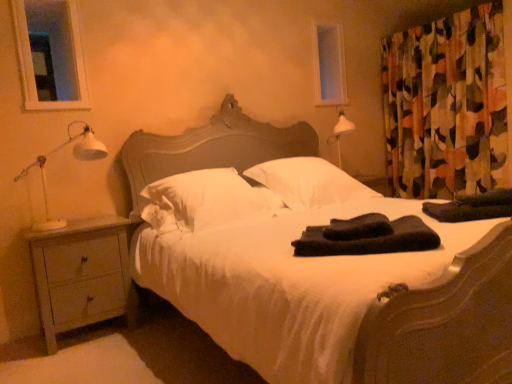
What are the coordinates of `white satin bed at center` in the screenshot? It's located at click(x=340, y=299).

Image resolution: width=512 pixels, height=384 pixels. What do you see at coordinates (204, 200) in the screenshot? I see `white soft pillow at center, positioned as the first pillow in left-to-right order` at bounding box center [204, 200].

At what (x,y) coordinates should I click in order to perform the action: click on transparent glass window screen at upper center, which is the 2th window screen in front-to-back order. Please return your answer as a coordinate pair (x, y). The width and height of the screenshot is (512, 384). Looking at the image, I should click on (x=329, y=64).

This screenshot has width=512, height=384. Identify the location of transparent glass window at upper left, placed as the first window screen when sorted from front to back. (51, 52).

What do you see at coordinates (51, 52) in the screenshot? I see `transparent glass window at upper left, placed as the first window screen when sorted from front to back` at bounding box center [51, 52].

At what (x,y) coordinates should I click in order to perform the action: click on white matte table lamp at left. Please return your answer as a coordinate pair (x, y). Looking at the image, I should click on (74, 157).

Can you see black soft towels at center, the 1th material positioned from the front, touching black towel at right, which is counted as the 1th material, starting from the right?

There is a gap between black soft towels at center, the 1th material positioned from the front, and black towel at right, which is counted as the 1th material, starting from the right.

Locate an element on the screen. This screenshot has width=512, height=384. material that appears behind the black soft towels at center, the 2th material viewed from the right is located at coordinates (472, 207).

Between black soft towels at center, the 1th material positioned from the front, and black towel at right, which is counted as the 1th material, starting from the right, which one appears on the left side from the viewer's perspective?

Positioned to the left is black soft towels at center, the 1th material positioned from the front.

Does point (298, 253) lie in front of point (471, 211)?

Yes, it is.

In terms of width, does black soft towel at center look wider or thinner when compared to white soft pillow at center, which is the 2th pillow in right-to-left order?

black soft towel at center is thinner than white soft pillow at center, which is the 2th pillow in right-to-left order.

Is black soft towel at center not near white soft pillow at center, which is the 2th pillow in right-to-left order?

No, black soft towel at center is not far away from white soft pillow at center, which is the 2th pillow in right-to-left order.

Is black soft towel at center positioned with its back to white soft pillow at center, positioned as the first pillow in left-to-right order?

No, black soft towel at center's orientation is not away from white soft pillow at center, positioned as the first pillow in left-to-right order.

What's the angular difference between black soft towel at center and white soft pillow at center, positioned as the first pillow in left-to-right order,'s facing directions?

There is a 45.9-degree angle between the facing directions of black soft towel at center and white soft pillow at center, positioned as the first pillow in left-to-right order.

Is black soft towels at center, the 1th material positioned from the front, to the left or to the right of transparent glass window screen at upper center, acting as the first window screen starting from the back, in the image?

black soft towels at center, the 1th material positioned from the front, is to the left of transparent glass window screen at upper center, acting as the first window screen starting from the back.

In the scene shown: Does black soft towels at center, the 2th material viewed from the right, have a lesser height compared to transparent glass window screen at upper center, which is the second window screen from left to right?

Yes, black soft towels at center, the 2th material viewed from the right, is shorter than transparent glass window screen at upper center, which is the second window screen from left to right.

Is black soft towels at center, arranged as the second material when viewed from the back, located outside transparent glass window screen at upper center, which is the 2th window screen in front-to-back order?

Yes, black soft towels at center, arranged as the second material when viewed from the back, is located beyond the bounds of transparent glass window screen at upper center, which is the 2th window screen in front-to-back order.

From the image's perspective, which is above, white soft pillow at center, which is the 2th pillow in right-to-left order, or black towel at right, which is the second material in left-to-right order?

white soft pillow at center, which is the 2th pillow in right-to-left order, appears higher in the image.

Between white soft pillow at center, which is the 2th pillow in right-to-left order, and black towel at right, which is the second material in left-to-right order, which one has more height?

white soft pillow at center, which is the 2th pillow in right-to-left order.

Does point (208, 209) lie in front of point (445, 219)?

Yes, point (208, 209) is closer to viewer.

Considering the relative positions of white soft pillow at center, which is the 2th pillow in right-to-left order, and black towel at right, which is counted as the 1th material, starting from the right, in the image provided, is white soft pillow at center, which is the 2th pillow in right-to-left order, behind black towel at right, which is counted as the 1th material, starting from the right,?

Yes, it is.

Considering the sizes of objects white soft pillow at center, which appears as the 1th pillow when viewed from the right, and white satin bed at center in the image provided, who is thinner, white soft pillow at center, which appears as the 1th pillow when viewed from the right, or white satin bed at center?

white soft pillow at center, which appears as the 1th pillow when viewed from the right, is thinner.

Considering the points (278, 168) and (252, 365), which point is behind, point (278, 168) or point (252, 365)?

Positioned behind is point (278, 168).

Are white soft pillow at center, which appears as the 1th pillow when viewed from the right, and white satin bed at center beside each other?

white soft pillow at center, which appears as the 1th pillow when viewed from the right, is not next to white satin bed at center, and they're not touching.

Is black towel at right, the first material when ordered from back to front, facing towards light gray wood nightstand at lower left?

No, black towel at right, the first material when ordered from back to front, is not oriented towards light gray wood nightstand at lower left.

Which object is positioned more to the left, black towel at right, which is counted as the 1th material, starting from the right, or light gray wood nightstand at lower left?

light gray wood nightstand at lower left is more to the left.

From a real-world perspective, is black towel at right, the first material when ordered from back to front, positioned above or below light gray wood nightstand at lower left?

From a real-world perspective, black towel at right, the first material when ordered from back to front, is physically above light gray wood nightstand at lower left.

Does black towel at right, which is the second material in left-to-right order, have a lesser height compared to light gray wood nightstand at lower left?

Indeed, black towel at right, which is the second material in left-to-right order, has a lesser height compared to light gray wood nightstand at lower left.

Considering the relative sizes of white satin bed at center and white soft pillow at center, positioned as the first pillow in left-to-right order, in the image provided, is white satin bed at center bigger than white soft pillow at center, positioned as the first pillow in left-to-right order,?

Yes, white satin bed at center is bigger than white soft pillow at center, positioned as the first pillow in left-to-right order.

Which of these two, white satin bed at center or white soft pillow at center, which is the 2th pillow in right-to-left order, is wider?

Wider between the two is white satin bed at center.

Can you tell me how much white satin bed at center and white soft pillow at center, which is the 2th pillow in right-to-left order, differ in facing direction?

white satin bed at center and white soft pillow at center, which is the 2th pillow in right-to-left order, are facing 5.54e-05 degrees away from each other.

Would you say white satin bed at center contains white soft pillow at center, positioned as the first pillow in left-to-right order?

Yes, white satin bed at center is surrounding white soft pillow at center, positioned as the first pillow in left-to-right order.

Locate an element on the screen. Image resolution: width=512 pixels, height=384 pixels. material above the black soft towels at center, the 2th material viewed from the right (from the image's perspective) is located at coordinates (472, 207).

Identify the location of blanket that appears in front of the white soft pillow at center, positioned as the first pillow in left-to-right order. click(x=358, y=228).

When comparing their distances from transparent glass window screen at upper center, acting as the first window screen starting from the back, does black soft towels at center, the 1th material positioned from the front, or white satin bed at center seem further?

black soft towels at center, the 1th material positioned from the front.

From the image, which object appears to be nearer to white soft pillow at center, which is the 2th pillow in right-to-left order, light gray wood nightstand at lower left or black towel at right, which ranks as the 2th material in front-to-back order?

The object closer to white soft pillow at center, which is the 2th pillow in right-to-left order, is light gray wood nightstand at lower left.

Estimate the real-world distances between objects in this image. Which object is further from white soft pillow at center, positioned as the first pillow in left-to-right order, black soft towels at center, the 2th material viewed from the right, or white satin bed at center?

black soft towels at center, the 2th material viewed from the right, lies further to white soft pillow at center, positioned as the first pillow in left-to-right order, than the other object.

Considering their positions, is white soft pillow at center, which appears as the 1th pillow when viewed from the right, positioned closer to abstract fabric curtain at right than white matte table lamp at left?

white soft pillow at center, which appears as the 1th pillow when viewed from the right, is positioned closer to the anchor abstract fabric curtain at right.

When comparing their distances from black soft towels at center, the 2th material viewed from the right, does transparent glass window screen at upper center, the 1th window screen from the right, or white soft pillow at center, arranged as the 2th pillow when viewed from the left, seem closer?

Based on the image, white soft pillow at center, arranged as the 2th pillow when viewed from the left, appears to be nearer to black soft towels at center, the 2th material viewed from the right.

When comparing their distances from white matte table lamp at left, does black soft towel at center or black soft towels at center, the 1th material positioned from the front, seem closer?

black soft towels at center, the 1th material positioned from the front, lies closer to white matte table lamp at left than the other object.

Estimate the real-world distances between objects in this image. Which object is further from transparent glass window at upper left, the first window screen viewed from the left, abstract fabric curtain at right or light gray wood nightstand at lower left?

abstract fabric curtain at right.

Based on their spatial positions, is transparent glass window at upper left, the first window screen viewed from the left, or black soft towel at center closer to white matte table lamp at left?

transparent glass window at upper left, the first window screen viewed from the left, is closer to white matte table lamp at left.

Find the location of a particular element. This screenshot has height=384, width=512. nightstand located between transparent glass window at upper left, the first window screen viewed from the left, and black soft towel at center in the left-right direction is located at coordinates 82,274.

Locate an element on the screen. The height and width of the screenshot is (384, 512). curtain between black soft towels at center, arranged as the second material when viewed from the back, and transparent glass window screen at upper center, the 1th window screen from the right, along the z-axis is located at coordinates (446, 105).

Where is `window screen located between transparent glass window at upper left, which is the second window screen in back-to-front order, and abstract fabric curtain at right in the left-right direction`? The height and width of the screenshot is (384, 512). window screen located between transparent glass window at upper left, which is the second window screen in back-to-front order, and abstract fabric curtain at right in the left-right direction is located at coordinates (329, 64).

Locate an element on the screen. The image size is (512, 384). material between white matte table lamp at left and black towel at right, which ranks as the 2th material in front-to-back order, in the horizontal direction is located at coordinates (367, 237).